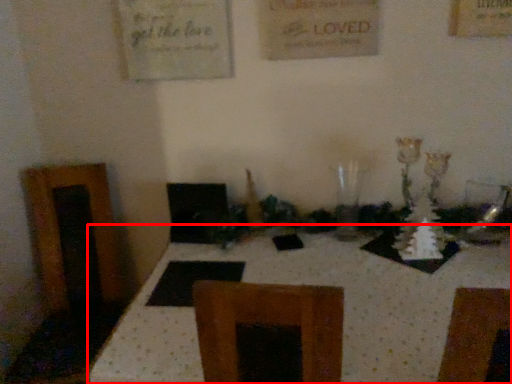
Question: From the image's perspective, considering the relative positions of table (annotated by the red box) and glass vase in the image provided, where is table (annotated by the red box) located with respect to the staircase?

Choices:
 (A) below
 (B) above

Answer: (A)